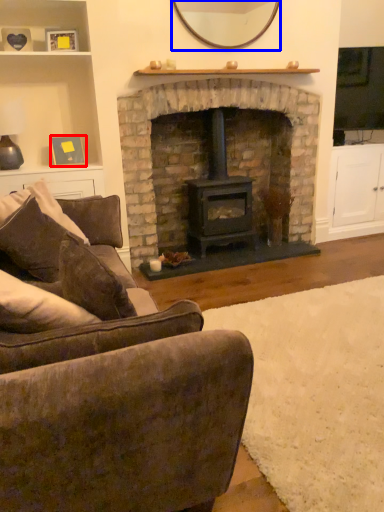
Question: Among these objects, which one is nearest to the camera, picture frame (highlighted by a red box) or mirror (highlighted by a blue box)?

Choices:
 (A) picture frame
 (B) mirror

Answer: (B)